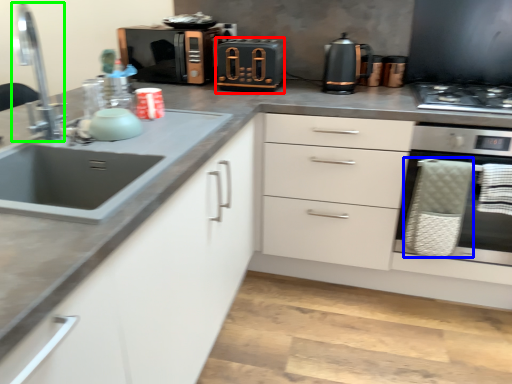
Question: Based on their relative distances, which object is farther from appliance (highlighted by a red box)? Choose from basket (highlighted by a blue box) and faucet (highlighted by a green box).

Choices:
 (A) basket
 (B) faucet

Answer: (B)